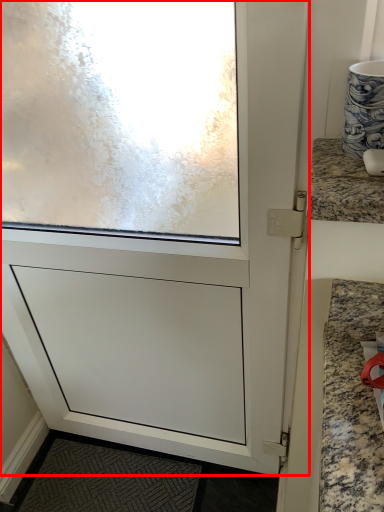
Question: From the image's perspective, where is screen door (annotated by the red box) located relative to countertop?

Choices:
 (A) above
 (B) below

Answer: (B)